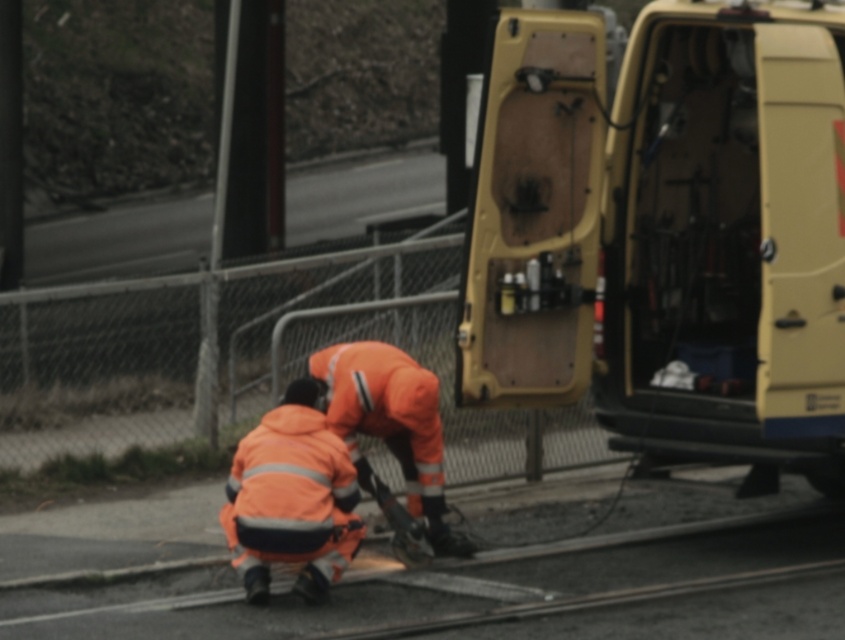
Question: Which point appears farthest from the camera in this image?

Choices:
 (A) (350, 467)
 (B) (592, 260)

Answer: (B)

Question: Does orange reflective jacket at lower center appear on the right side of orange reflective jumpsuit at center?

Choices:
 (A) no
 (B) yes

Answer: (A)

Question: Can you confirm if orange reflective jacket at lower center is positioned to the right of orange reflective jumpsuit at center?

Choices:
 (A) no
 (B) yes

Answer: (A)

Question: Is orange reflective jacket at lower center in front of orange reflective jumpsuit at center?

Choices:
 (A) yes
 (B) no

Answer: (A)

Question: Which point appears closest to the camera in this image?

Choices:
 (A) (297, 458)
 (B) (822, 296)

Answer: (A)

Question: Which point is closer to the camera?

Choices:
 (A) orange reflective jumpsuit at center
 (B) beige matte van door at center
 (C) orange reflective jacket at lower center

Answer: (C)